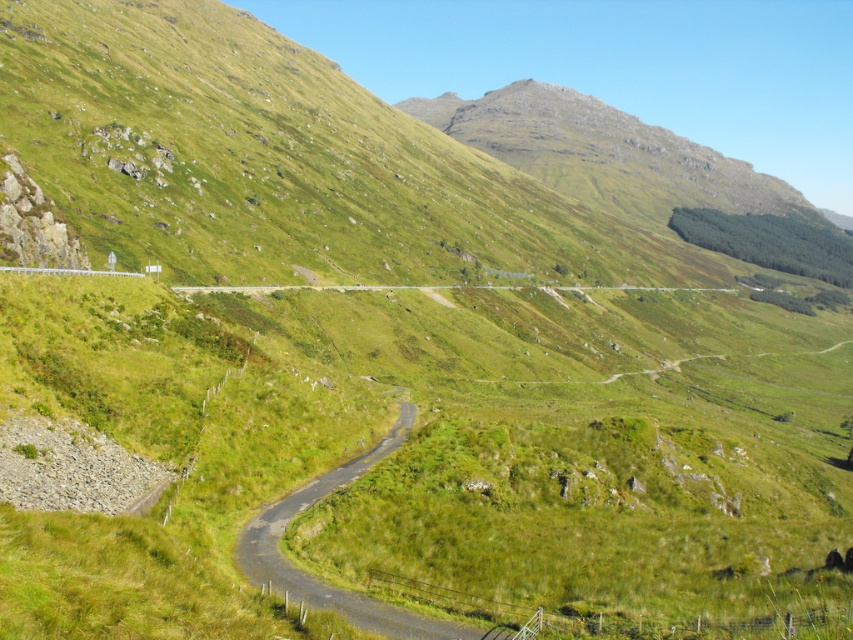
Question: Among these objects, which one is nearest to the camera?

Choices:
 (A) green grassy mountain at upper center
 (B) green asphalt road at center

Answer: (B)

Question: Which of the following is the farthest from the observer?

Choices:
 (A) (577, 160)
 (B) (323, 595)

Answer: (A)

Question: Which object appears farthest from the camera in this image?

Choices:
 (A) green grassy mountain at upper center
 (B) green asphalt road at center

Answer: (A)

Question: Is green grassy mountain at upper center further to camera compared to green asphalt road at center?

Choices:
 (A) yes
 (B) no

Answer: (A)

Question: Does green grassy mountain at upper center have a smaller size compared to green asphalt road at center?

Choices:
 (A) yes
 (B) no

Answer: (B)

Question: Observing the image, what is the correct spatial positioning of green grassy mountain at upper center in reference to green asphalt road at center?

Choices:
 (A) left
 (B) right

Answer: (B)